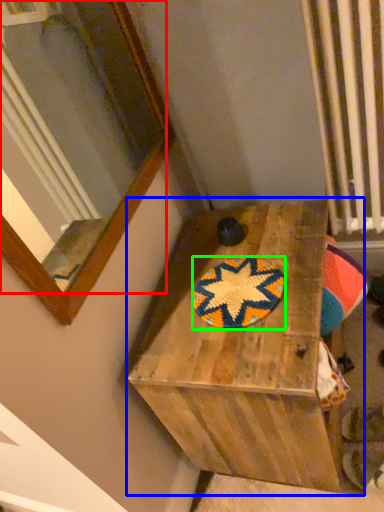
Question: Based on their relative distances, which object is farther from mirror (highlighted by a red box)? Choose from furniture (highlighted by a blue box) and mat (highlighted by a green box).

Choices:
 (A) furniture
 (B) mat

Answer: (B)